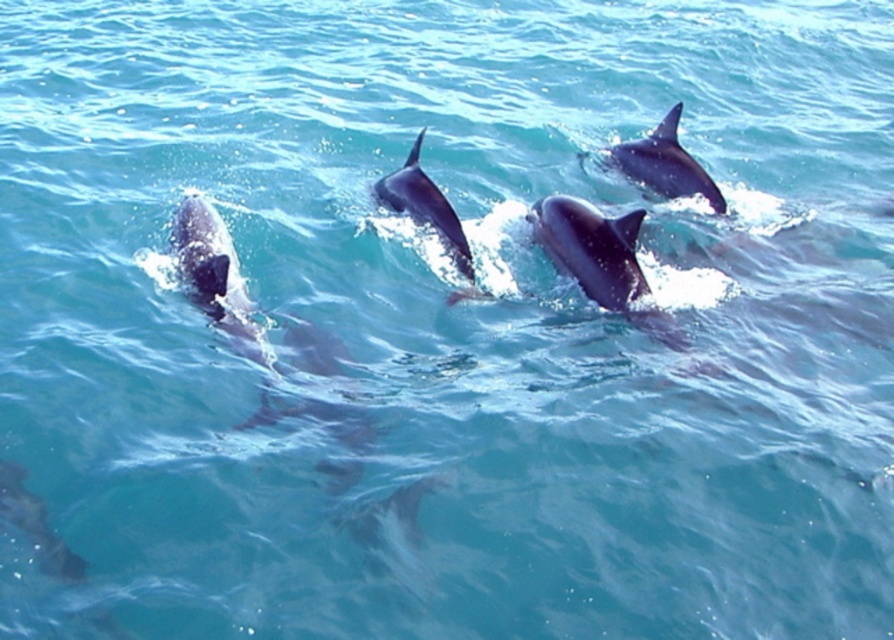
You are a marine biologist observing dolphins in the ocean. You notice two dolphins, the glossy blue dolphin at upper right and the glossy gray dolphin at center. Which dolphin is located higher in the water?

The glossy blue dolphin at upper right is positioned over the glossy gray dolphin at center, so it is higher in the water.

You are a marine biologist observing dolphins in the ocean. You notice two points in the water at coordinates point (194, 273) and point (464, 262). Which point is closer to your viewpoint?

Point (194, 273) is closer to the camera than point (464, 262).

You are a dolphin trainer observing the dolphins in the ocean. You notice two points where the dolphins are swimming. The first point is at coordinate [538,212] and the second is at [53,531]. From your viewpoint, which point is closer to you?

Point [53,531] is closer to you because the point [538,212] is behind it.